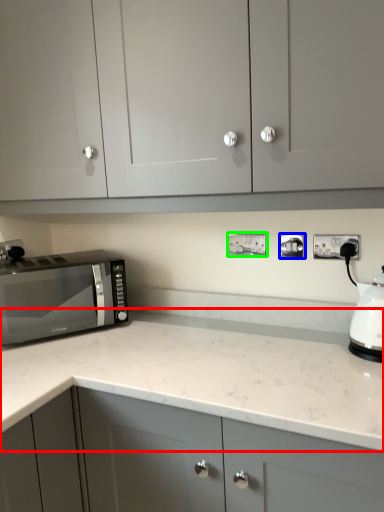
Question: Estimate the real-world distances between objects in this image. Which object is farther from countertop (highlighted by a red box), electric outlet (highlighted by a blue box) or electric outlet (highlighted by a green box)?

Choices:
 (A) electric outlet
 (B) electric outlet

Answer: (A)